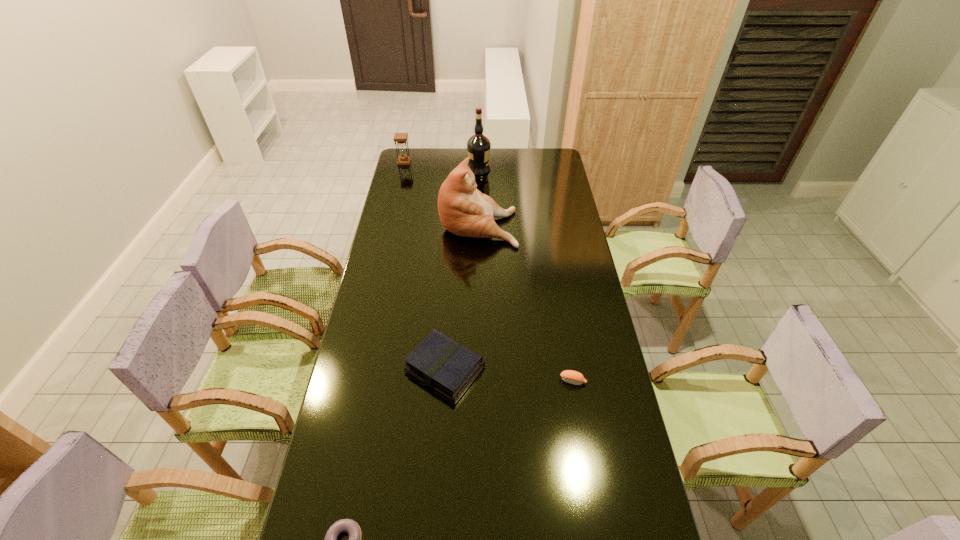
You are a GUI agent. You are given a task and a screenshot of the screen. Output one action in this format:
    pyautogui.click(x=<x>, y=<y>)
    Task: Click on the object that stands as the closest to the shortest object
    The image size is (960, 540).
    Given the screenshot: What is the action you would take?
    pyautogui.click(x=441, y=363)

The height and width of the screenshot is (540, 960). In order to click on free space in the image that satisfies the following two spatial constraints: 1. on the surface of the second shortest object; 2. on the right side of the liquor in this screenshot , I will do `click(478, 381)`.

Identify the location of free space in the image that satisfies the following two spatial constraints: 1. on the front side of the hourglass; 2. on the right side of the fifth tallest object. The width and height of the screenshot is (960, 540). (353, 381).

Identify the location of vacant space that satisfies the following two spatial constraints: 1. on the face of the fourth nearest object; 2. on the back side of the sushi. This screenshot has width=960, height=540. (478, 381).

At what (x,y) coordinates should I click in order to perform the action: click on free space that satisfies the following two spatial constraints: 1. on the back side of the rightmost object; 2. on the surface of the liquor. Please return your answer as a coordinate pair (x, y). This screenshot has height=540, width=960. Looking at the image, I should click on (537, 170).